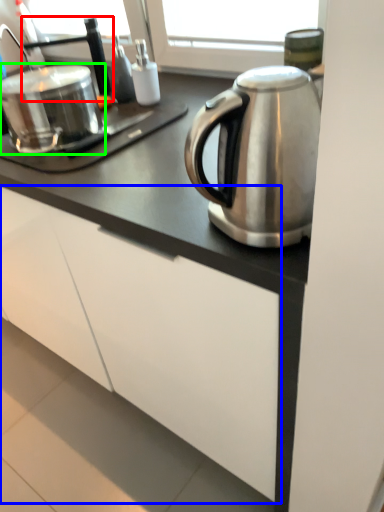
Question: Estimate the real-world distances between objects in this image. Which object is closer to faucet (highlighted by a red box), cabinetry (highlighted by a blue box) or appliance (highlighted by a green box)?

Choices:
 (A) cabinetry
 (B) appliance

Answer: (B)